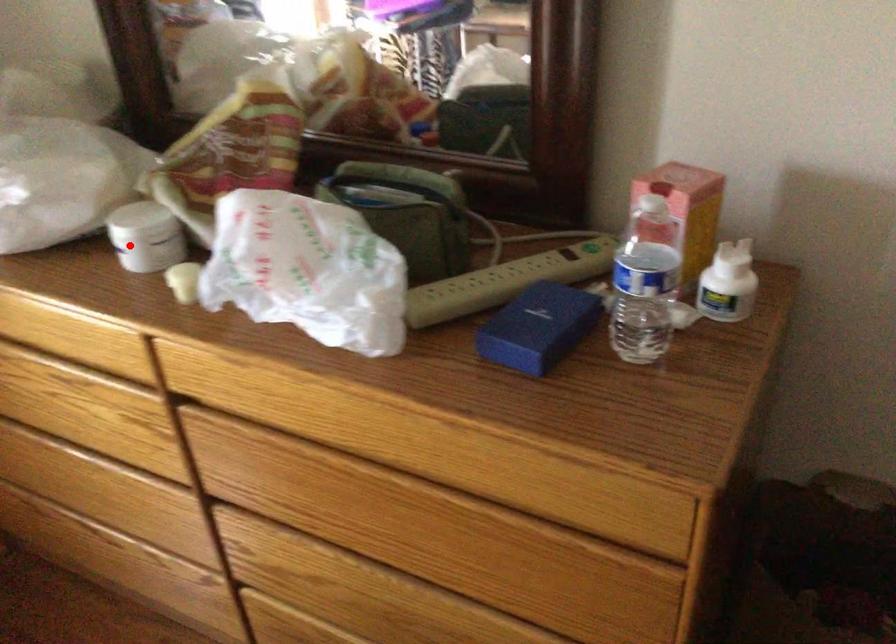
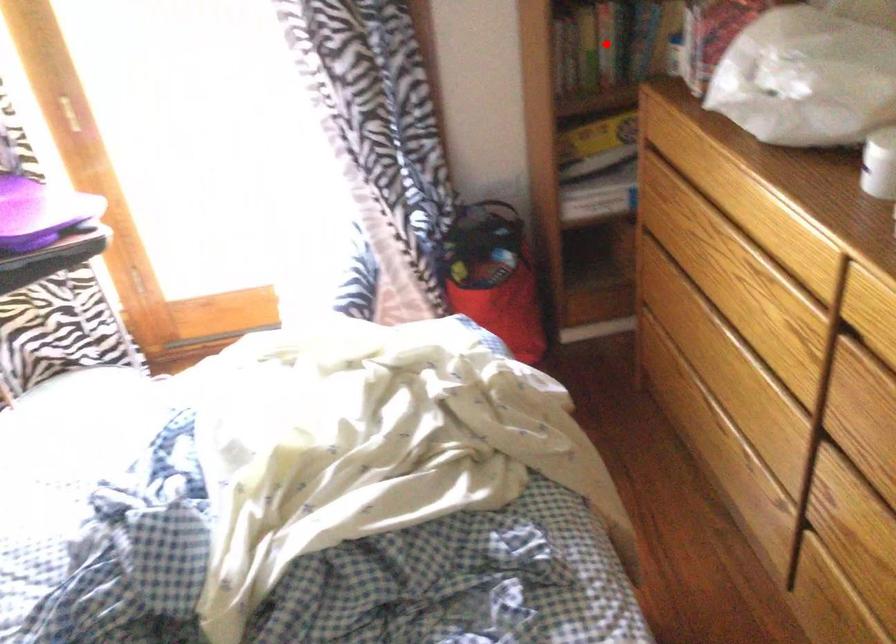
I am providing you with two images of the same scene from different viewpoints. A red point is marked on the first image and another point is marked on the second image. Is the marked point in image1 the same physical position as the marked point in image2?

No